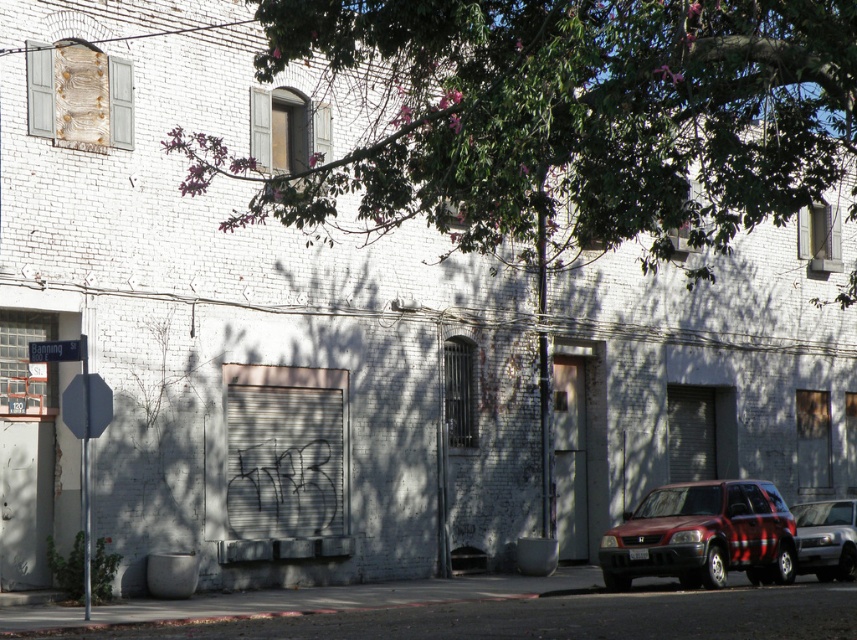
Consider the image. You are standing at the stop sign pole on the sidewalk in front of the weathered white brick building. You want to walk to a specific location. If you face towards the building, which point would you reach first if you walk straight ahead? The point labeled as point (606, 184) or point (61, 353)?

Since point (606, 184) is in front of point (61, 353), you would reach point (606, 184) first when walking straight ahead towards the building.

You are standing at the sidewalk in front of the building and want to take a photo of the green leafy tree at upper center. If your camera can focus on objects up to 50 feet away, will you be able to capture a clear photo?

The green leafy tree at upper center is 40.60 feet away from the camera, which is within the camera focus range of up to 50 feet. Therefore, you can capture a clear photo.